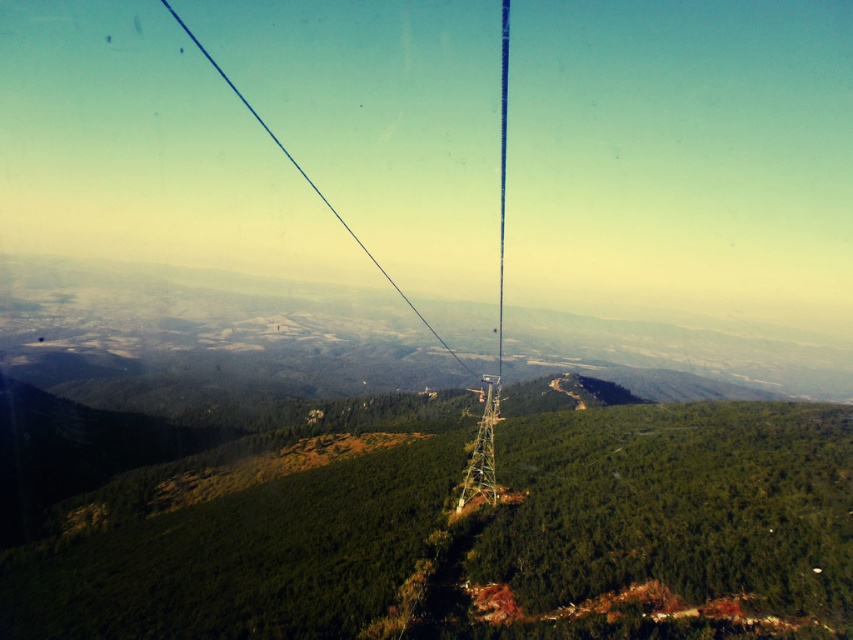
You are a maintenance worker needing to inspect the blue wire at center and the metallic silver cable at center from the cable car. Given that your inspection tool has a 600 feet range, can you reach both objects with a single tool? Please explain your reasoning.

The blue wire at center and metallic silver cable at center are 654.29 feet apart. Since the inspection tool only has a 600 feet range, you cannot reach both objects with a single tool as the distance exceeds the tool range.

You are a maintenance worker inspecting the cables of the gondola from the cabin. You notice two cables in front of you. Which one is located to the left when comparing the blue wire at center and the metallic silver cable at center?

The blue wire at center is positioned on the left side of the metallic silver cable at center, so the blue wire at center is the one located to the left.

You are a technician inspecting the cables of the gondola system from the cable car. You notice two cables at the center of your view. Which one is shorter in height between the blue wire at center and the metallic silver cable at center?

The blue wire at center is not as tall as the metallic silver cable at center, so the blue wire at center is shorter in height.